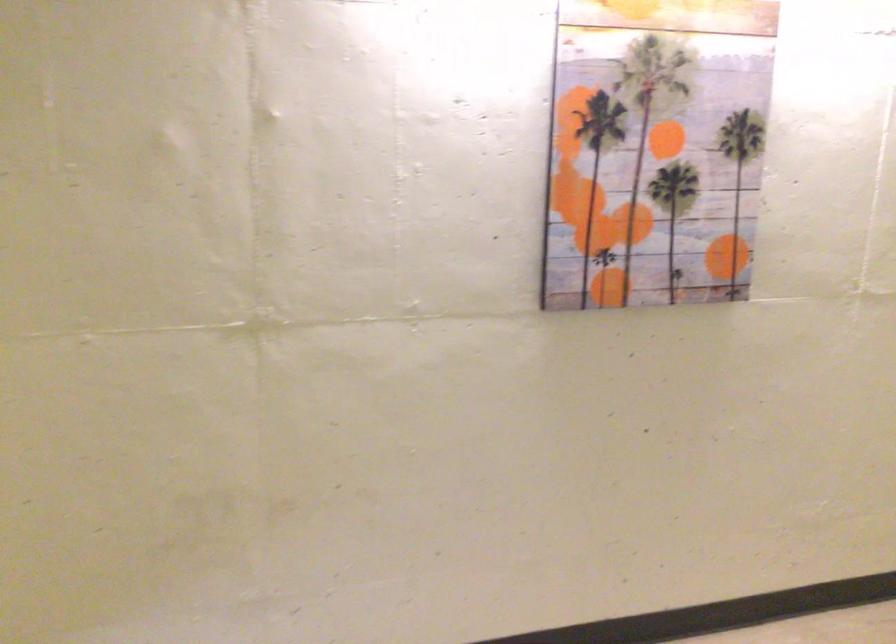
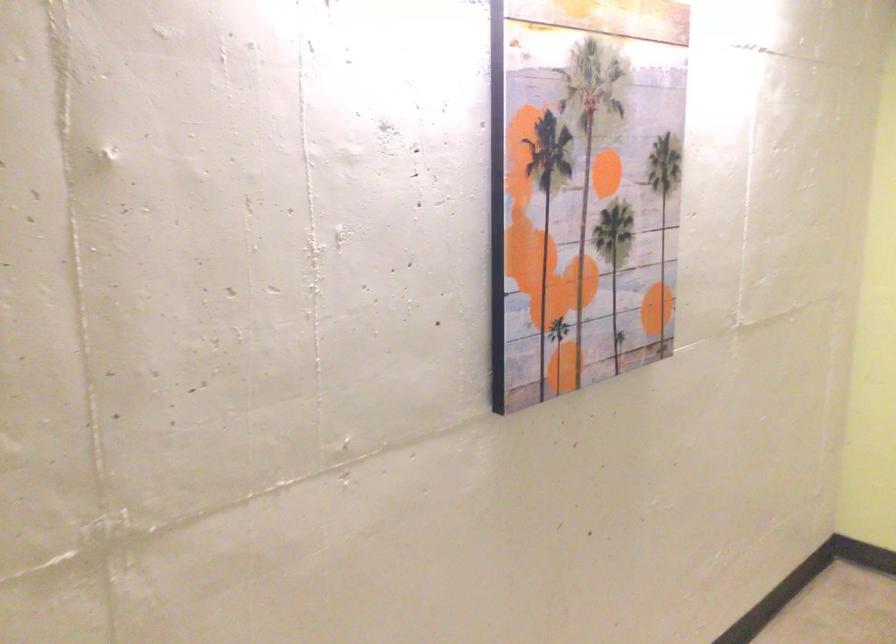
Question: The camera is either moving clockwise (left) or counter-clockwise (right) around the object. The first image is from the beginning of the video and the second image is from the end. Is the camera moving left or right when shooting the video?

Choices:
 (A) Left
 (B) Right

Answer: (A)